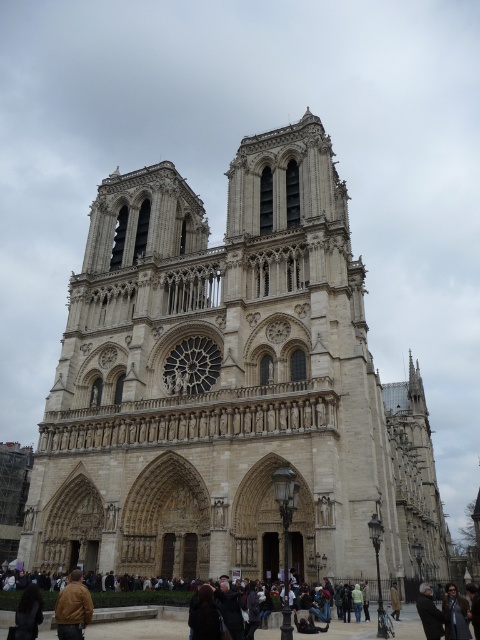
Question: Among these objects, which one is farthest from the camera?

Choices:
 (A) brown leather jacket at lower left
 (B) brown wool coat at lower center
 (C) dark gray coat at lower right

Answer: (B)

Question: Is white stone church at center smaller than brown leather jacket at lower left?

Choices:
 (A) no
 (B) yes

Answer: (A)

Question: Is white stone church at center further to camera compared to brown leather jacket at lower left?

Choices:
 (A) no
 (B) yes

Answer: (B)

Question: Among these objects, which one is nearest to the camera?

Choices:
 (A) white stone church at center
 (B) dark gray coat at lower right

Answer: (B)

Question: Can you confirm if dark gray coat at lower right is positioned to the right of brown wool coat at lower center?

Choices:
 (A) no
 (B) yes

Answer: (B)

Question: Which object is farther from the camera taking this photo?

Choices:
 (A) brown wool coat at lower center
 (B) dark gray coat at lower right
 (C) white stone church at center
 (D) brown leather jacket at lower left

Answer: (A)